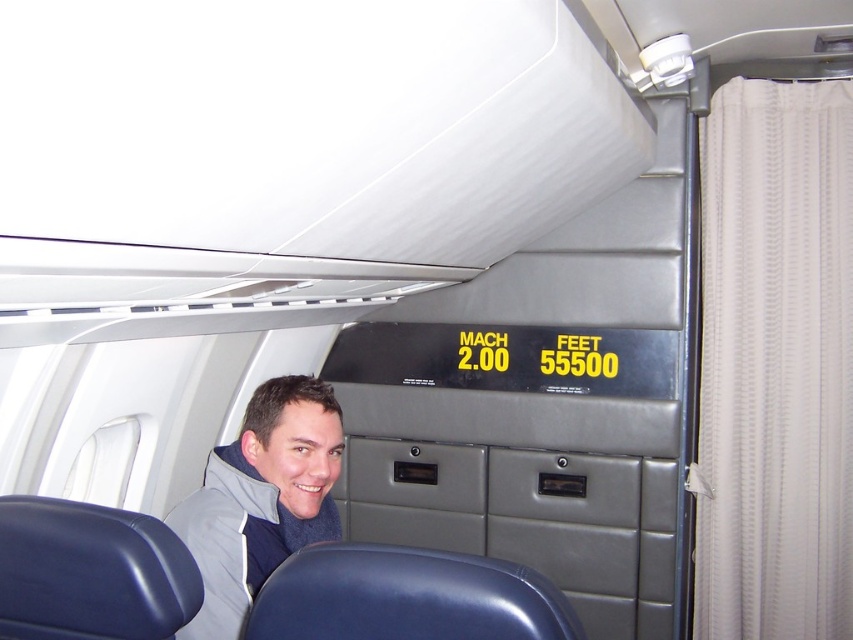
You are a flight attendant checking the storage space under the seat in front of you. You have a gray fleece jacket at lower left and a blue leather seat at lower center. Which item takes up more space in the storage area?

The gray fleece jacket at lower left is larger in size than the blue leather seat at lower center, so the gray fleece jacket at lower left takes up more space in the storage area.

Consider the image. You are a flight attendant carrying a 24 inch tray. You need to move from the gray fleece jacket at lower left to the blue leather seat at lower center. Can you fit the tray between them without tilting it?

The gray fleece jacket at lower left and blue leather seat at lower center are 25.31 inches apart from each other. Since the tray is 24 inches long, it can fit between them without tilting.

You are seated in the blue leather seat at lower center and want to reach for your gray fleece jacket at lower left. Which direction should you move to get closer to it?

The gray fleece jacket at lower left is further to the viewer than the blue leather seat at lower center, so you should move forward to get closer to it.